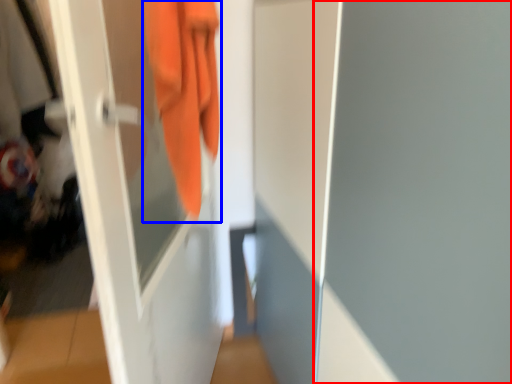
Question: Which point is further to the camera, screen door (highlighted by a red box) or towel (highlighted by a blue box)?

Choices:
 (A) screen door
 (B) towel

Answer: (B)